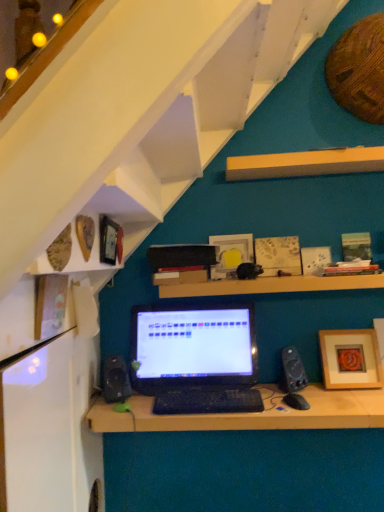
Question: Considering the positions of wooden picture frame at lower right, the 3th picture frame from the back, and wooden textured picture frame at upper center, arranged as the second picture frame when viewed from the right, in the image, is wooden picture frame at lower right, the 3th picture frame from the back, taller or shorter than wooden textured picture frame at upper center, arranged as the second picture frame when viewed from the right,?

Choices:
 (A) short
 (B) tall

Answer: (B)

Question: Looking at their shapes, would you say wooden picture frame at lower right, the third picture frame positioned from the front, is wider or thinner than wooden textured picture frame at upper center, the 2th picture frame positioned from the back?

Choices:
 (A) thin
 (B) wide

Answer: (B)

Question: Which is farther from the black matte laptop at center?

Choices:
 (A) matte white picture frame at center, the third picture frame from the right
 (B) black plastic keyboard at center
 (C) wooden at center, the first shelf from the bottom
 (D) wooden shelves at upper left, which is the second shelf from top to bottom
 (E) wooden picture frame at lower right, positioned as the 1th picture frame in right-to-left order

Answer: (D)

Question: Based on their relative distances, which object is farther from the black plastic keyboard at center?

Choices:
 (A) wooden shelves at upper left, the 2th shelf ordered from the bottom
 (B) black matte speaker at right, which is the first loudspeaker from right to left
 (C) black matte desk at center
 (D) wooden picture frame at lower right, positioned as the 1th picture frame in right-to-left order
 (E) black matte laptop at center

Answer: (A)